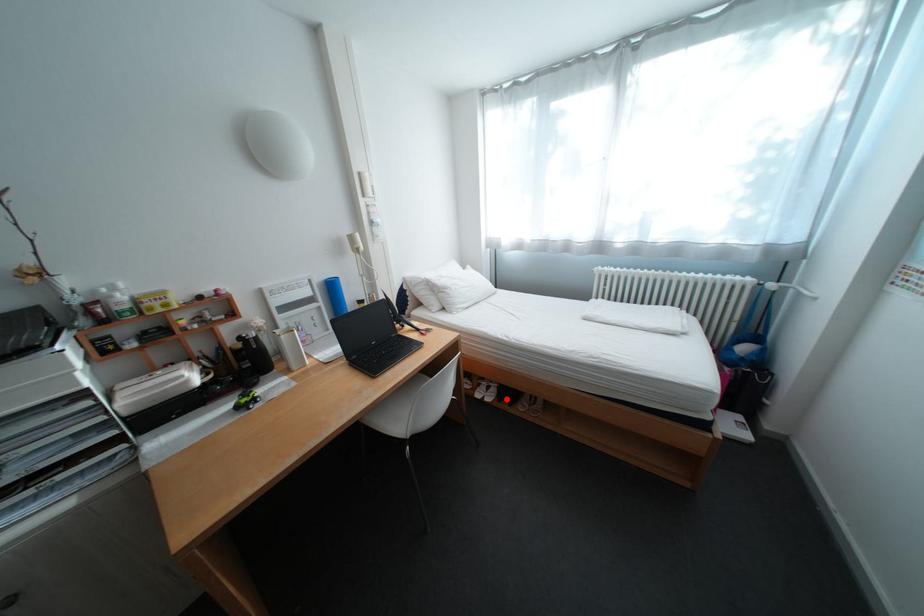
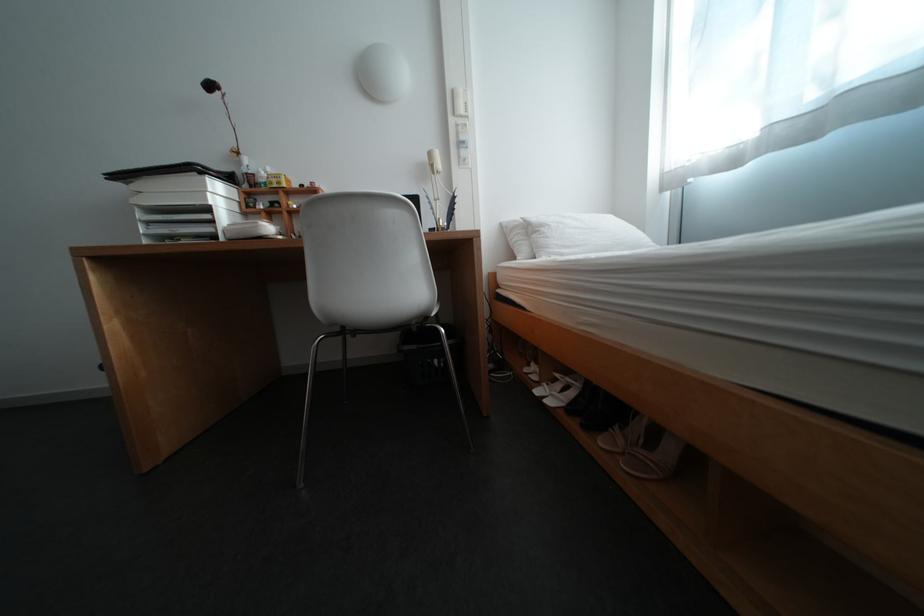
Question: I am providing you with two images of the same scene from different viewpoints. Image1 has a red point marked. In image2, the corresponding 3D location appears at what relative position? Reply with the corresponding letter.

Choices:
 (A) Closer
 (B) Farther

Answer: (A)